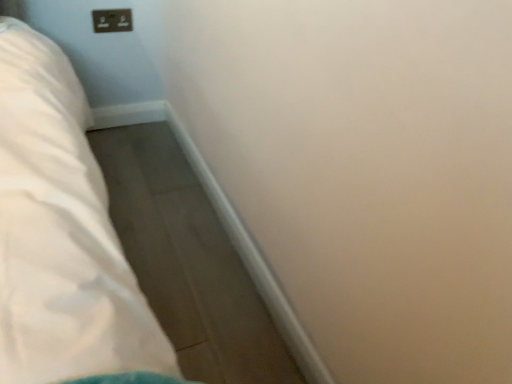
Question: Should I look upward or downward to see matte black outlet at upper left?

Choices:
 (A) down
 (B) up

Answer: (B)